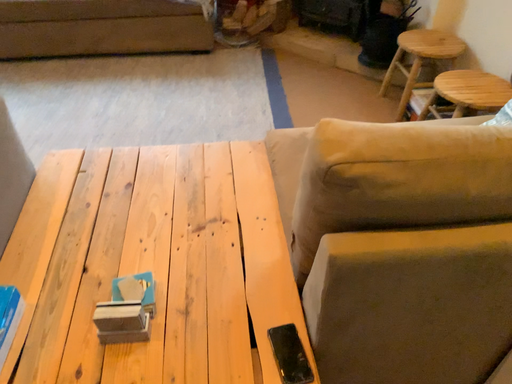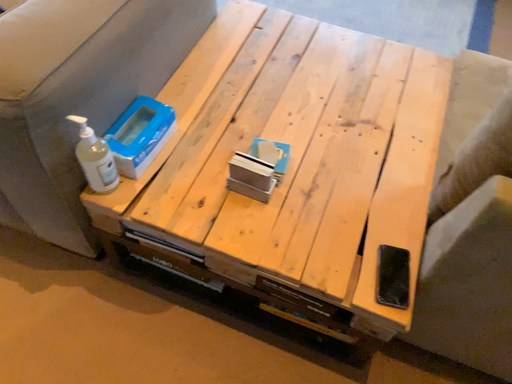
Question: How did the camera likely rotate when shooting the video?

Choices:
 (A) rotated downward
 (B) rotated upward

Answer: (A)